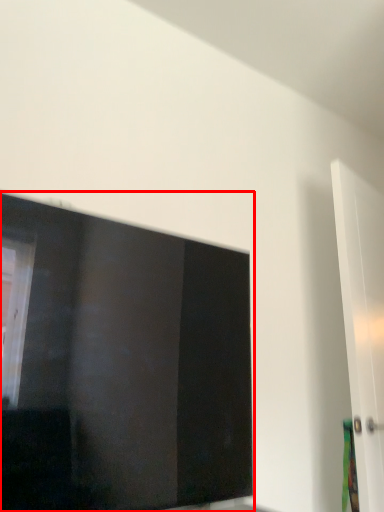
Question: From the image's perspective, considering the relative positions of window (annotated by the red box) and door in the image provided, where is window (annotated by the red box) located with respect to the staircase?

Choices:
 (A) below
 (B) above

Answer: (B)